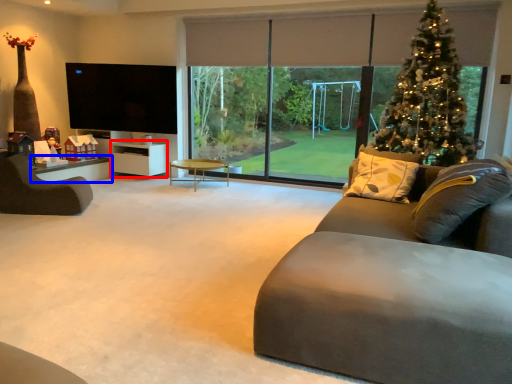
Question: Which object is further to the camera taking this photo, entertainment center (highlighted by a red box) or table (highlighted by a blue box)?

Choices:
 (A) entertainment center
 (B) table

Answer: (A)